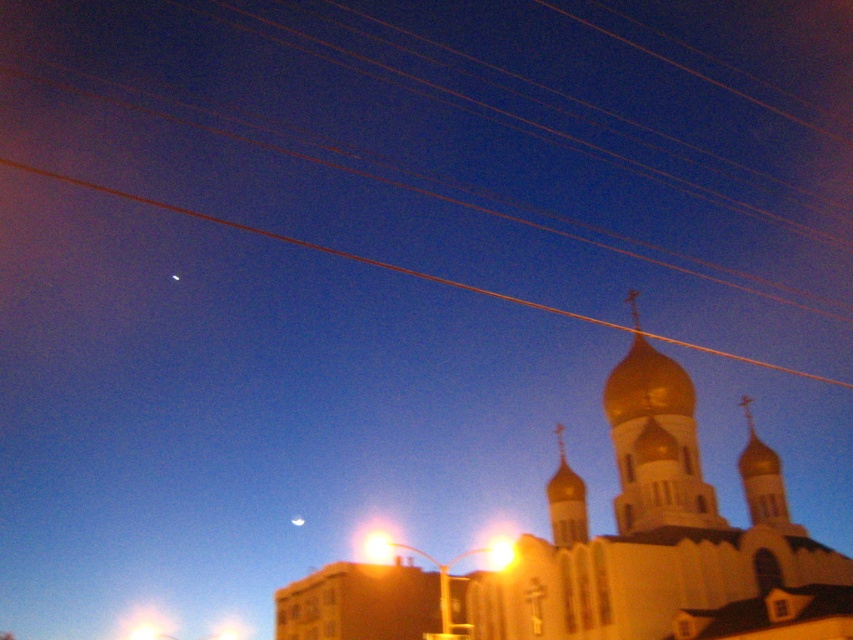
Is gold domed spire at upper center thinner than bright yellow light at upper center?

Indeed, gold domed spire at upper center has a lesser width compared to bright yellow light at upper center.

Does gold domed spire at upper center come in front of bright yellow light at upper center?

That is False.

Does point (585, 522) lie behind point (489, 554)?

That is False.

At what (x,y) coordinates should I click in order to perform the action: click on gold domed spire at upper center. Please return your answer as a coordinate pair (x, y). Looking at the image, I should click on (566, 500).

Measure the distance between gold domed church at center and camera.

59.96 meters

Can you confirm if gold domed church at center is smaller than gold domed spire at upper center?

No, gold domed church at center is not smaller than gold domed spire at upper center.

Find the location of a particular element. gold domed church at center is located at coordinates (660, 532).

Measure the distance from gold domed church at center to bright yellow light at upper center.

gold domed church at center is 18.81 meters away from bright yellow light at upper center.

Who is more distant from viewer, (564, 621) or (506, 557)?

Point (506, 557)

You are a GUI agent. You are given a task and a screenshot of the screen. Output one action in this format:
    pyautogui.click(x=<x>, y=<y>)
    Task: Click on the gold domed church at center
    
    Given the screenshot: What is the action you would take?
    pyautogui.click(x=660, y=532)